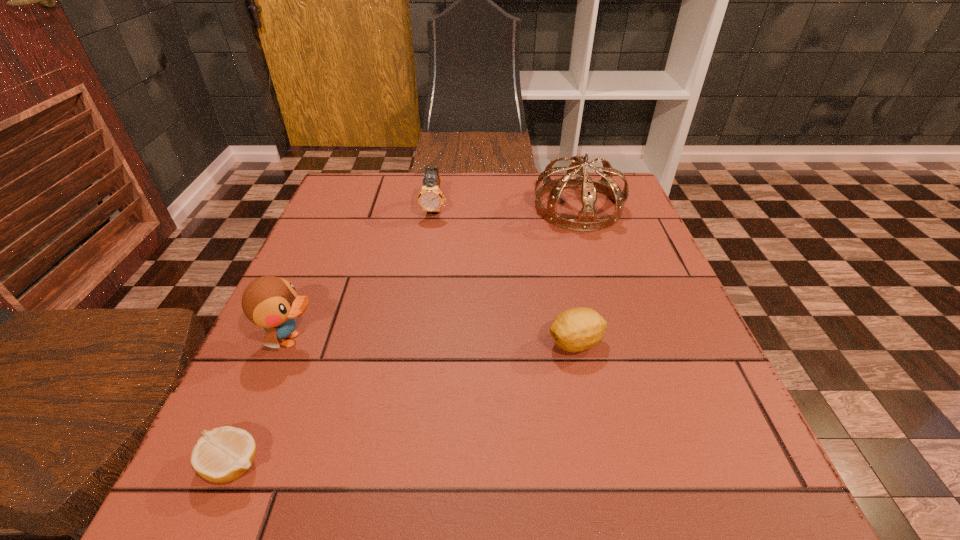
Image resolution: width=960 pixels, height=540 pixels. What are the coordinates of `free space between the shortest object and the tiara` in the screenshot? It's located at (406, 336).

Image resolution: width=960 pixels, height=540 pixels. Find the location of `free area in between the third shortest object and the right lemon`. free area in between the third shortest object and the right lemon is located at coordinates (505, 276).

Locate an element on the screen. This screenshot has width=960, height=540. free space between the duck and the nearer lemon is located at coordinates (263, 402).

Where is `free space between the duck and the shorter lemon`? free space between the duck and the shorter lemon is located at coordinates (263, 402).

Identify the location of unoccupied area between the left lemon and the watch. (334, 336).

The image size is (960, 540). In order to click on free space between the shortest object and the duck in this screenshot , I will do `click(263, 402)`.

Identify the location of free space that is in between the left lemon and the duck. This screenshot has height=540, width=960. (263, 402).

The width and height of the screenshot is (960, 540). I want to click on vacant space in between the duck and the tiara, so tap(435, 273).

The height and width of the screenshot is (540, 960). I want to click on unoccupied position between the watch and the shortest object, so click(x=334, y=336).

Identify which object is the third closest to the third tallest object. Please provide its 2D coordinates. Your answer should be formatted as a tuple, i.e. [(x, y)], where the tuple contains the x and y coordinates of a point satisfying the conditions above.

[(574, 330)]